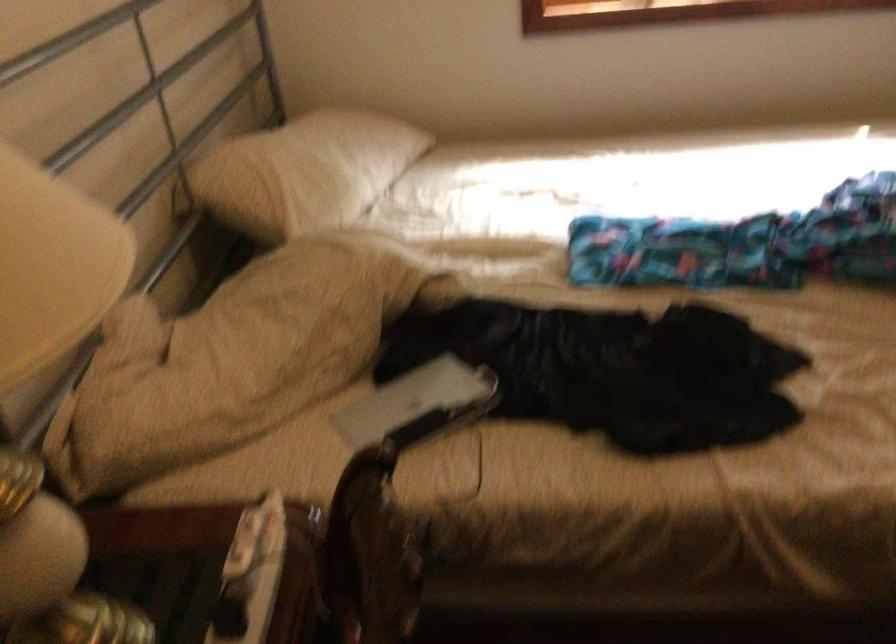
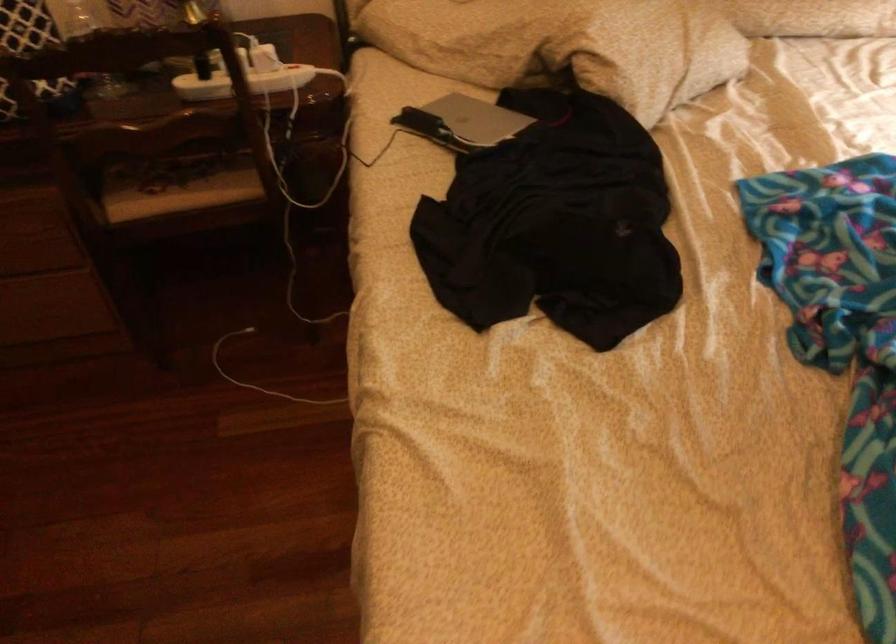
Where in the second image is the point corresponding to [418,399] from the first image?

(477, 118)